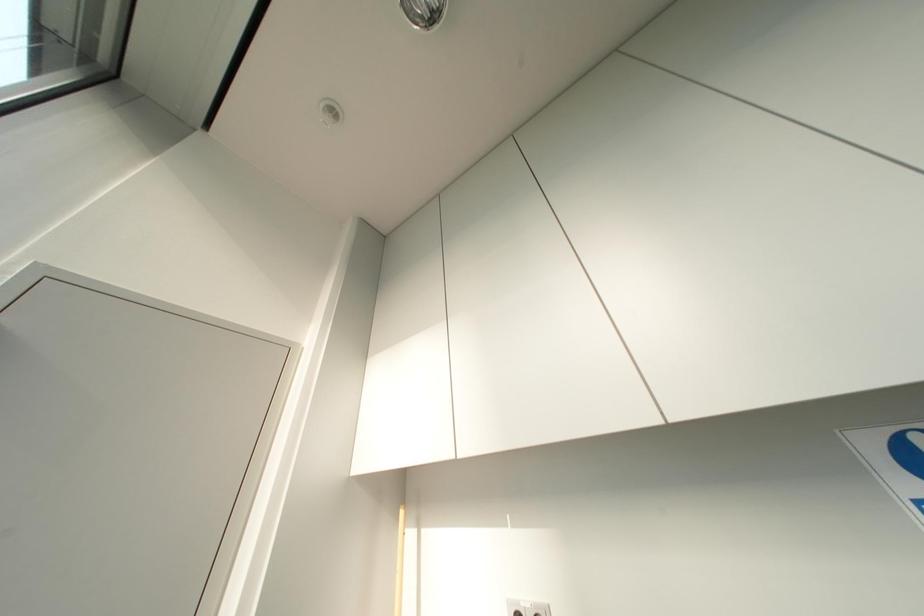
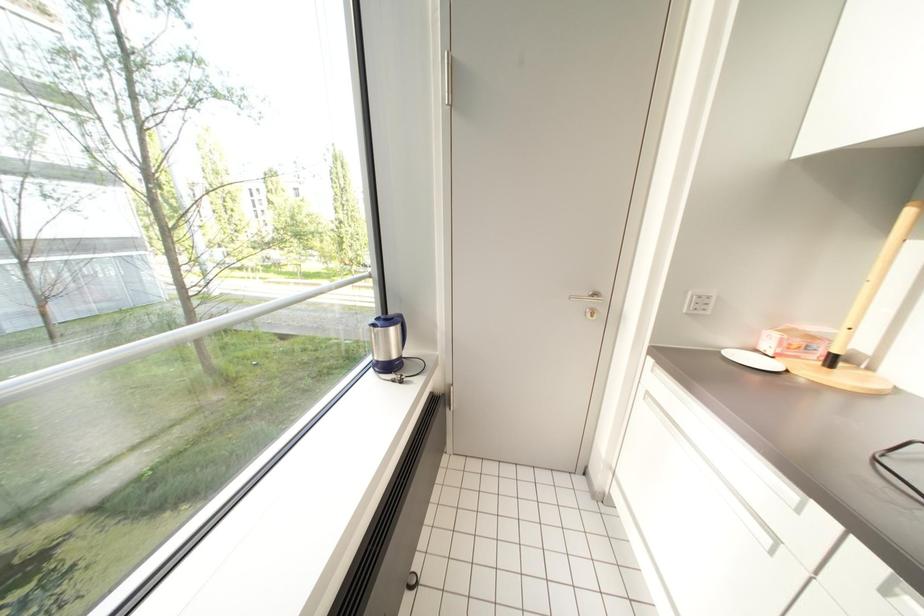
First-person continuous shooting, in which direction is the camera rotating?

The camera's rotation is toward left-down.